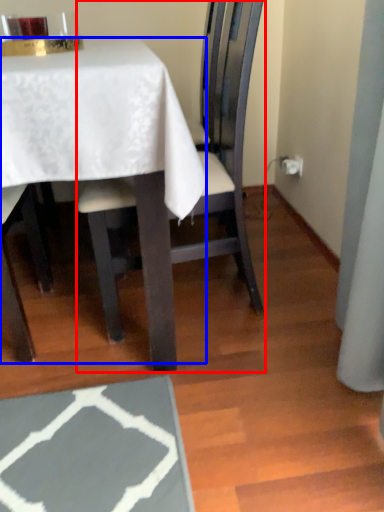
Question: Which point is further to the camera, chair (highlighted by a red box) or table (highlighted by a blue box)?

Choices:
 (A) chair
 (B) table

Answer: (A)